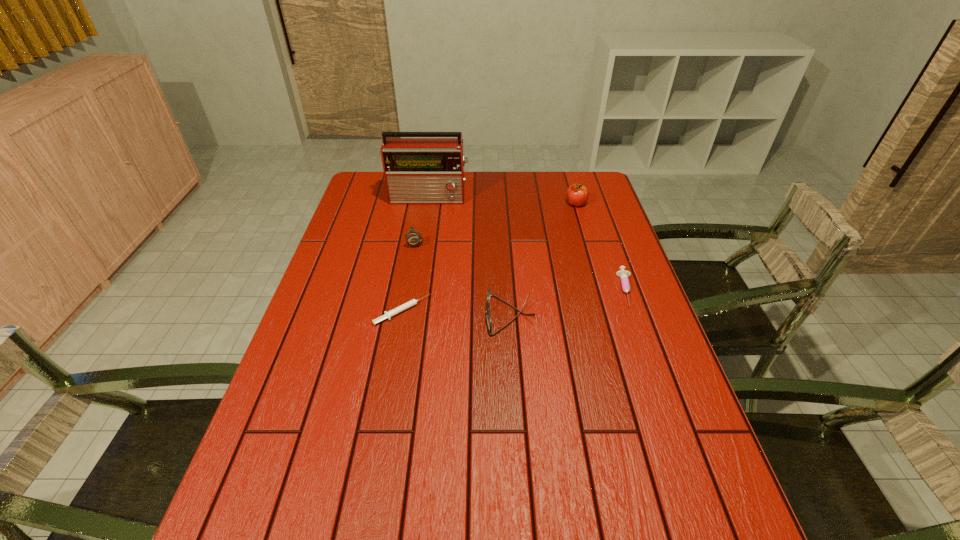
What are the coordinates of `apple at the right edge` in the screenshot? It's located at (577, 194).

The width and height of the screenshot is (960, 540). What are the coordinates of `syringe at the right edge` in the screenshot? It's located at (623, 274).

I want to click on object at the far left corner, so click(x=417, y=170).

At what (x,y) coordinates should I click in order to perform the action: click on object situated at the far right corner. Please return your answer as a coordinate pair (x, y). The height and width of the screenshot is (540, 960). Looking at the image, I should click on (577, 194).

Find the location of a particular element. vacant space at the far edge of the desktop is located at coordinates (x=507, y=199).

The image size is (960, 540). In the image, there is a desktop. Find the location of `free space at the left edge`. free space at the left edge is located at coordinates (335, 300).

In the image, there is a desktop. Identify the location of vacant space at the right edge. The height and width of the screenshot is (540, 960). (614, 249).

Locate an element on the screen. free space at the far left corner of the desktop is located at coordinates (364, 171).

Identify the location of vacant area between the spectacles and the shortest object. (456, 313).

You are a GUI agent. You are given a task and a screenshot of the screen. Output one action in this format:
    pyautogui.click(x=<x>, y=<y>)
    Task: Click on the free point between the fourth nearest object and the apple
    
    Given the screenshot: What is the action you would take?
    click(x=495, y=222)